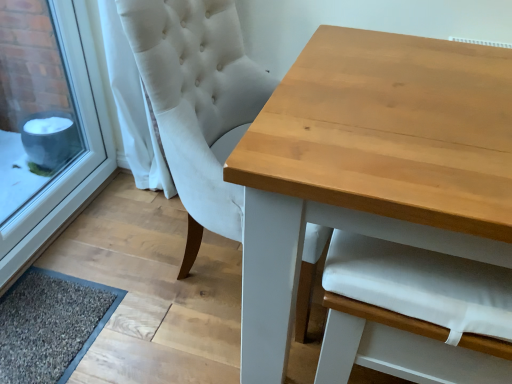
Identify the location of light brown wooden table at center. (366, 160).

This screenshot has width=512, height=384. Describe the element at coordinates (50, 325) in the screenshot. I see `dark gray textured mat at lower left` at that location.

Describe the element at coordinates (133, 107) in the screenshot. I see `white fabric curtain at left` at that location.

At what (x,y) coordinates should I click in order to perform the action: click on white plastic window frame at lower left. Please return your answer as a coordinate pair (x, y). The height and width of the screenshot is (384, 512). Looking at the image, I should click on (47, 126).

This screenshot has width=512, height=384. In order to click on light brown wooden table at center in this screenshot , I will do `click(366, 160)`.

Is white fabric curtain at left positioned with its back to white fabric armchair at center?

white fabric curtain at left is not turned away from white fabric armchair at center.

Is white fabric curtain at left with white fabric armchair at center?

No, white fabric curtain at left is not with white fabric armchair at center.

Considering the positions of objects white fabric curtain at left and white fabric armchair at center in the image provided, who is in front, white fabric curtain at left or white fabric armchair at center?

white fabric armchair at center.

From a real-world perspective, is white fabric curtain at left below white fabric armchair at center?

No, from a real-world perspective, white fabric curtain at left is not below white fabric armchair at center.

Consider the image. From the image's perspective, is light brown wooden table at center positioned above or below white fabric curtain at left?

From the image's perspective, light brown wooden table at center appears below white fabric curtain at left.

Which is correct: light brown wooden table at center is inside white fabric curtain at left, or outside of it?

light brown wooden table at center is not inside white fabric curtain at left, it's outside.

Between light brown wooden table at center and white fabric curtain at left, which one has less height?

With less height is light brown wooden table at center.

From a real-world perspective, is light brown wooden table at center above or below white fabric curtain at left?

Clearly, from a real-world perspective, light brown wooden table at center is below white fabric curtain at left.

Between white fabric curtain at left and light brown wooden table at center, which one appears on the right side from the viewer's perspective?

light brown wooden table at center is more to the right.

Does white fabric curtain at left come behind light brown wooden table at center?

That is True.

In terms of width, does white fabric curtain at left look wider or thinner when compared to light brown wooden table at center?

Considering their sizes, white fabric curtain at left looks slimmer than light brown wooden table at center.

Between white fabric curtain at left and light brown wooden table at center, which one has larger size?

light brown wooden table at center is bigger.

How much distance is there between dark gray textured mat at lower left and white fabric armchair at center?

dark gray textured mat at lower left and white fabric armchair at center are 35.33 inches apart from each other.

Does dark gray textured mat at lower left come behind white fabric armchair at center?

Yes, dark gray textured mat at lower left is behind white fabric armchair at center.

This screenshot has width=512, height=384. I want to click on doormat located on the left of white fabric armchair at center, so click(x=50, y=325).

Could you tell me if dark gray textured mat at lower left is turned towards white fabric armchair at center?

No, dark gray textured mat at lower left is not aimed at white fabric armchair at center.

From the image's perspective, which is above, white fabric armchair at center or dark gray textured mat at lower left?

white fabric armchair at center appears higher in the image.

Is point (381, 294) closer or farther from the camera than point (14, 294)?

Point (381, 294) is closer to the camera than point (14, 294).

Is dark gray textured mat at lower left in contact with white plastic window frame at lower left?

No, dark gray textured mat at lower left is not in contact with white plastic window frame at lower left.

Considering the relative sizes of dark gray textured mat at lower left and white plastic window frame at lower left in the image provided, is dark gray textured mat at lower left bigger than white plastic window frame at lower left?

No.

Considering the relative sizes of dark gray textured mat at lower left and white plastic window frame at lower left in the image provided, is dark gray textured mat at lower left thinner than white plastic window frame at lower left?

No.

Relative to white plastic window frame at lower left, is dark gray textured mat at lower left in front or behind?

Clearly, dark gray textured mat at lower left is behind white plastic window frame at lower left.

Consider the image. Is white fabric chair at upper center inside the boundaries of white fabric curtain at left, or outside?

The correct answer is: outside.

Is white fabric chair at upper center shorter than white fabric curtain at left?

Result: In fact, white fabric chair at upper center may be taller than white fabric curtain at left.

How many degrees apart are the facing directions of white fabric chair at upper center and white fabric curtain at left?

The angle between the facing direction of white fabric chair at upper center and the facing direction of white fabric curtain at left is 1.5 degrees.

Can you confirm if white fabric chair at upper center is bigger than white fabric curtain at left?

Yes.

Locate an element on the screen. Image resolution: width=512 pixels, height=384 pixels. curtain that appears above the white fabric armchair at center (from a real-world perspective) is located at coordinates (133, 107).

The image size is (512, 384). I want to click on table lying in front of the white fabric curtain at left, so 366,160.

Estimate the real-world distances between objects in this image. Which object is closer to light brown wooden table at center, white fabric armchair at center or white plastic window frame at lower left?

white fabric armchair at center is closer to light brown wooden table at center.

From the picture: When comparing their distances from light brown wooden table at center, does white fabric curtain at left or white fabric chair at upper center seem closer?

Result: white fabric chair at upper center is closer to light brown wooden table at center.

Based on their spatial positions, is white fabric armchair at center or dark gray textured mat at lower left further from white fabric chair at upper center?

The object further to white fabric chair at upper center is dark gray textured mat at lower left.

Which object lies further to the anchor point dark gray textured mat at lower left, light brown wooden table at center or white fabric curtain at left?

light brown wooden table at center is positioned further to the anchor dark gray textured mat at lower left.

Looking at the image, which one is located further to white fabric chair at upper center, light brown wooden table at center or white fabric armchair at center?

white fabric armchair at center is further to white fabric chair at upper center.

Looking at the image, which one is located closer to white plastic window frame at lower left, dark gray textured mat at lower left or white fabric curtain at left?

Based on the image, white fabric curtain at left appears to be nearer to white plastic window frame at lower left.

From the image, which object appears to be farther from white plastic window frame at lower left, white fabric armchair at center or white fabric chair at upper center?

white fabric armchair at center is positioned further to the anchor white plastic window frame at lower left.

Which object lies further to the anchor point white fabric curtain at left, white plastic window frame at lower left or white fabric armchair at center?

white fabric armchair at center is positioned further to the anchor white fabric curtain at left.

Where is `curtain between white plastic window frame at lower left and white fabric armchair at center`? The image size is (512, 384). curtain between white plastic window frame at lower left and white fabric armchair at center is located at coordinates (133, 107).

I want to click on chair between dark gray textured mat at lower left and light brown wooden table at center in the horizontal direction, so click(197, 102).

You are a GUI agent. You are given a task and a screenshot of the screen. Output one action in this format:
    pyautogui.click(x=<x>, y=<y>)
    Task: Click on the armchair situated between dark gray textured mat at lower left and light brown wooden table at center from left to right
    This screenshot has height=384, width=512.
    Given the screenshot: What is the action you would take?
    pyautogui.click(x=407, y=297)

Identify the location of curtain between white plastic window frame at lower left and light brown wooden table at center from left to right. The height and width of the screenshot is (384, 512). (133, 107).